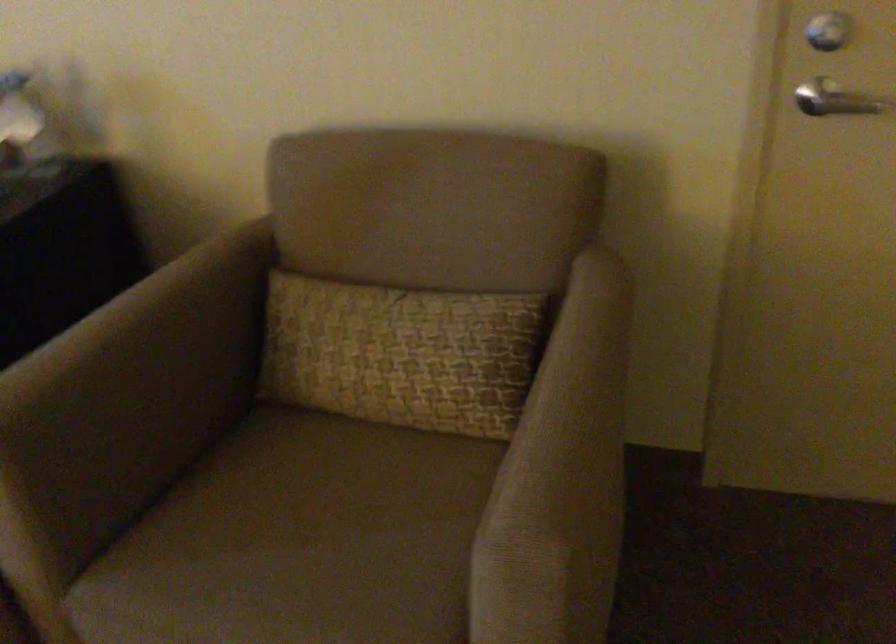
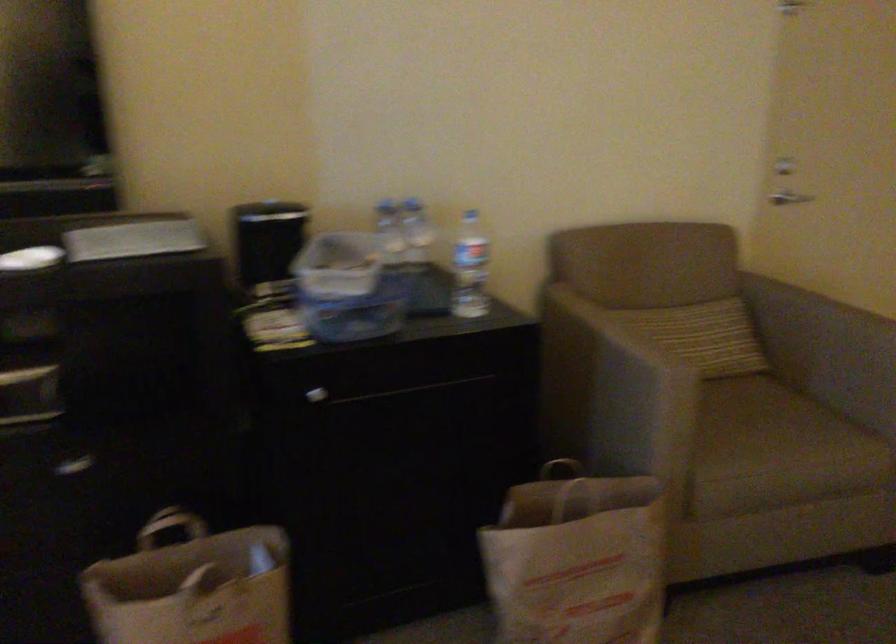
The point at (332, 538) is marked in the first image. Where is the corresponding point in the second image?

(762, 418)